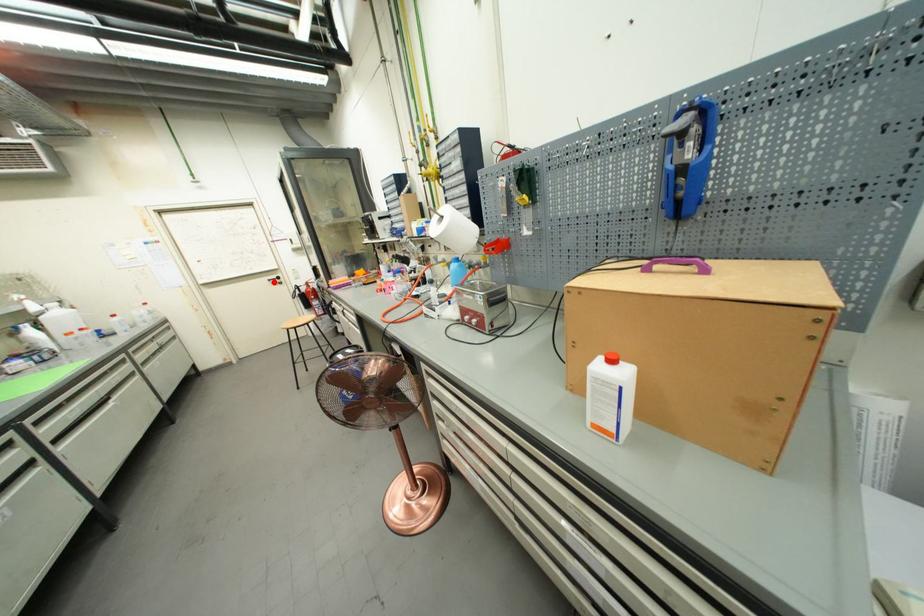
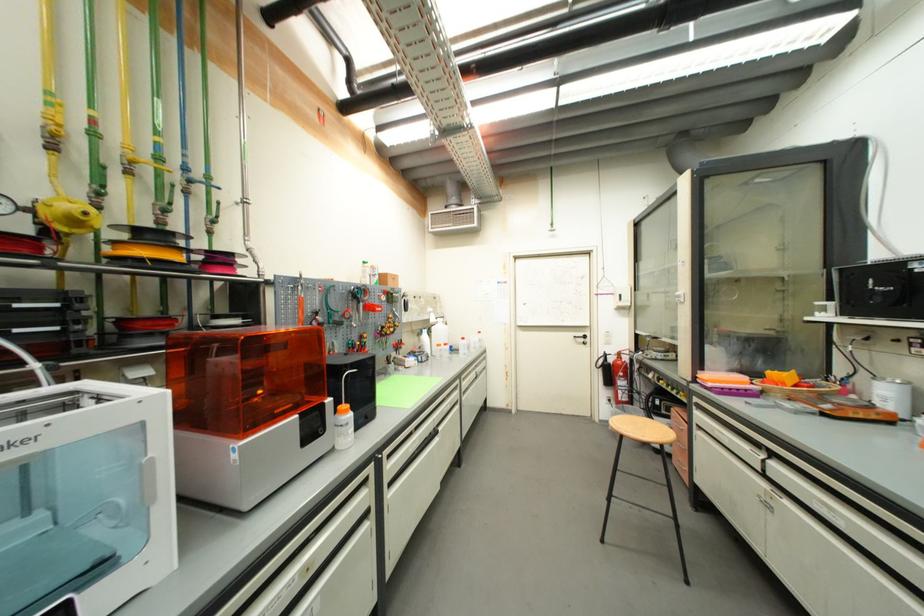
Question: A red point is marked in image1. In image2, is the corresponding 3D point closer to the camera or farther? Reply with the corresponding letter.

Choices:
 (A) The corresponding 3D point is closer.
 (B) The corresponding 3D point is farther.

Answer: (B)